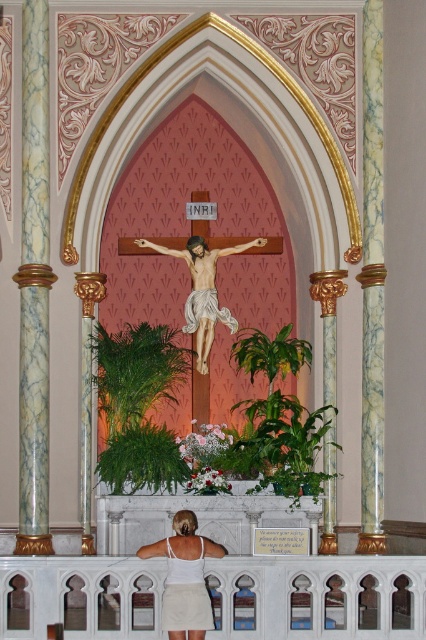
You are an interior designer planning to add a decorative banner to the church. You have a white fabric at lower center and a wooden crucifix at center. Which object has a smaller width?

The white fabric at lower center has a smaller width than the wooden crucifix at center according to the description.

You are an art student analyzing the church interior. You notice the white fabric at lower center and the wooden crucifix at center. Which object appears larger in the image?

The wooden crucifix at center is larger than the white fabric at lower center.